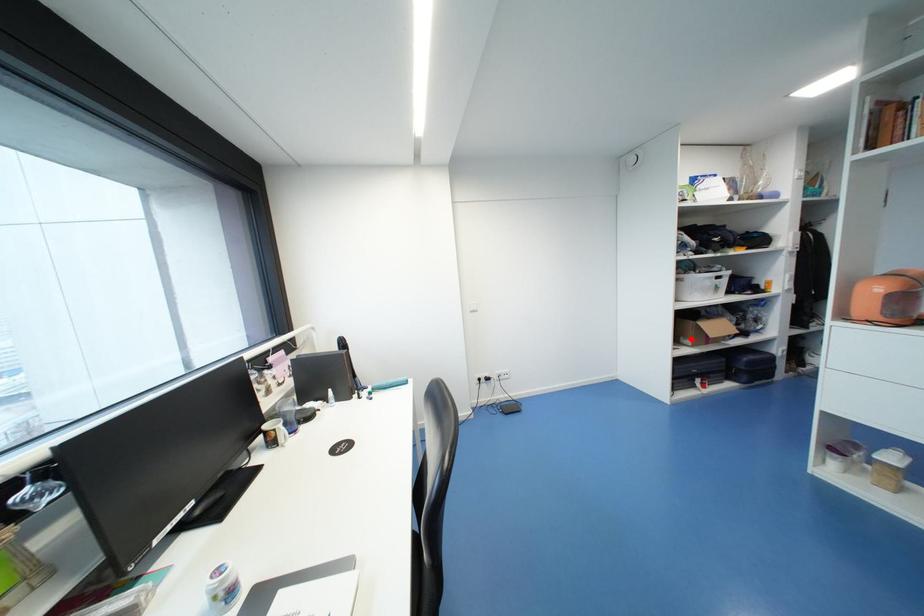
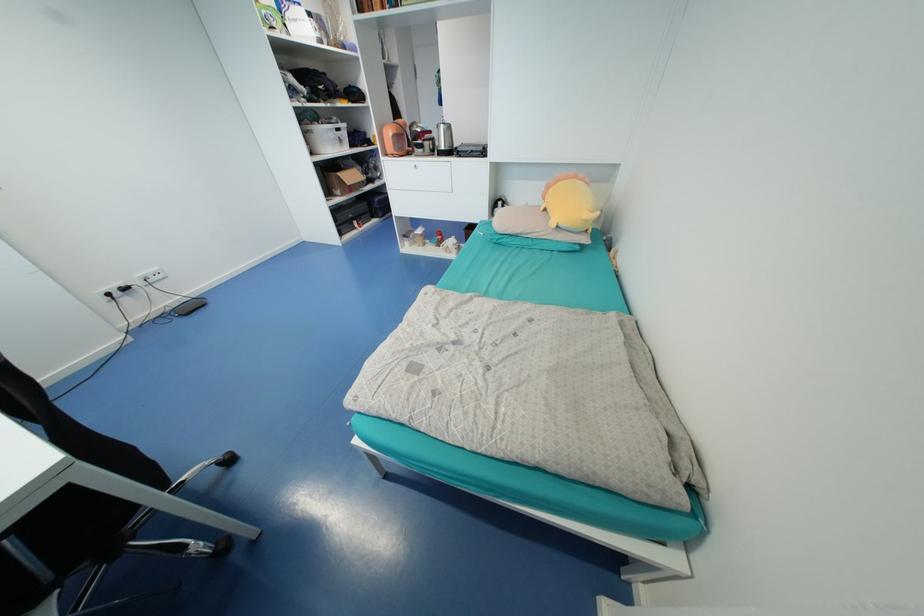
Question: I am providing you with two images of the same scene from different viewpoints. In image1, a red point is highlighted. Considering the same 3D point in image2, which of the following is correct?

Choices:
 (A) It is closer
 (B) It is farther

Answer: (A)